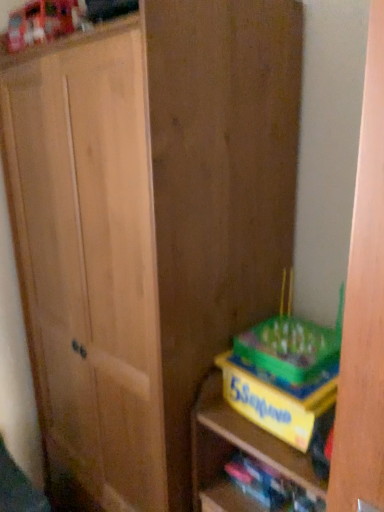
Question: In terms of size, does yellow cardboard game at lower right appear bigger or smaller than yellow cardboard game box at lower right?

Choices:
 (A) big
 (B) small

Answer: (A)

Question: Does point (236, 420) appear closer or farther from the camera than point (251, 403)?

Choices:
 (A) farther
 (B) closer

Answer: (A)

Question: Estimate the real-world distances between objects in this image. Which object is closer to the yellow cardboard book at lower right?

Choices:
 (A) yellow cardboard game at lower right
 (B) yellow cardboard game box at lower right

Answer: (A)

Question: Estimate the real-world distances between objects in this image. Which object is closer to the yellow cardboard book at lower right?

Choices:
 (A) yellow cardboard game box at lower right
 (B) yellow cardboard game at lower right

Answer: (B)